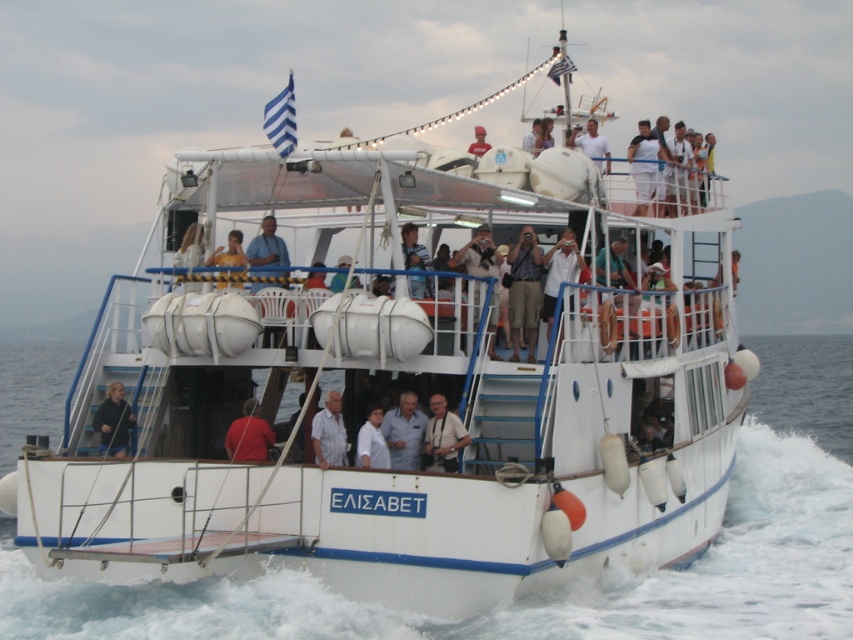
You are a photographer on the ferry and want to capture both the blue shirt at center and the light brown leather jacket at center in the same photo. Which one should you focus on first to ensure both are in frame?

The blue shirt at center is positioned under the light brown leather jacket at center, so focusing on the light brown leather jacket at center first would ensure both are in frame.

You are a passenger on the ferry and want to take a photo of the white water at lower center without anyone blocking your view. Is the blue shirt at center positioned in a way that might obstruct your shot?

The white water at lower center is located below the blue shirt at center, so the blue shirt at center is above it. Therefore, the blue shirt at center might block your view of the white water at lower center unless you move to a lower position or angle your camera downward.

You are a photographer on the ferry and you want to take a photo of the blue shirt at center and the light brown leather jacket at center. Which one is taller in the photo?

The blue shirt at center has a greater height compared to the light brown leather jacket at center, so the blue shirt at center is taller in the photo.